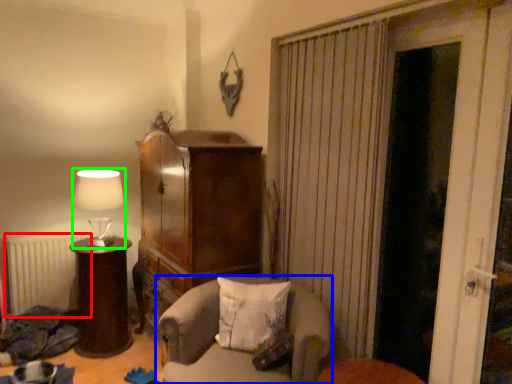
Question: Which is nearer to the radiator (highlighted by a red box)? chair (highlighted by a blue box) or lamp (highlighted by a green box).

Choices:
 (A) chair
 (B) lamp

Answer: (B)